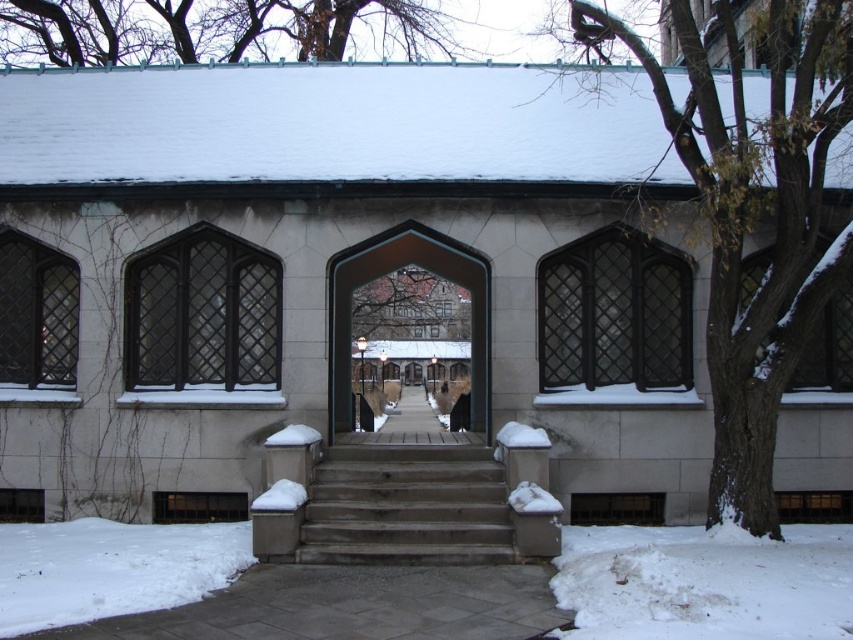
Measure the distance between point (399, 509) and camera.

A distance of 31.00 feet exists between point (399, 509) and camera.

Does point (438, 520) come closer to viewer compared to point (20, 624)?

That is False.

Between point (431, 460) and point (206, 552), which one is positioned in front?

Positioned in front is point (206, 552).

The width and height of the screenshot is (853, 640). What are the coordinates of `wooden stairs at center` in the screenshot? It's located at (405, 506).